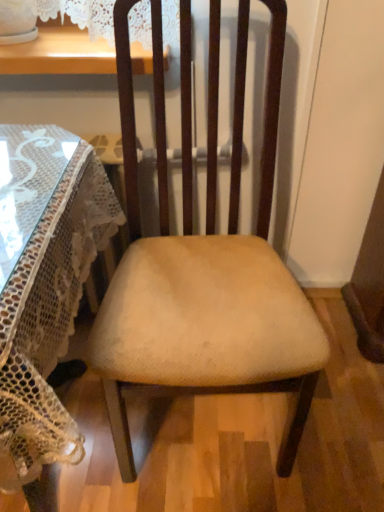
Question: In terms of size, does beige fabric chair at center appear bigger or smaller than transparent glass table at left?

Choices:
 (A) small
 (B) big

Answer: (A)

Question: Would you say beige fabric chair at center is inside or outside transparent glass table at left?

Choices:
 (A) inside
 (B) outside

Answer: (B)

Question: Considering the positions of beige fabric chair at center and transparent glass table at left in the image, is beige fabric chair at center wider or thinner than transparent glass table at left?

Choices:
 (A) thin
 (B) wide

Answer: (A)

Question: Looking at the image, does transparent glass table at left seem bigger or smaller compared to beige fabric chair at center?

Choices:
 (A) big
 (B) small

Answer: (A)

Question: Considering the relative positions of transparent glass table at left and beige fabric chair at center in the image provided, is transparent glass table at left to the left or to the right of beige fabric chair at center?

Choices:
 (A) right
 (B) left

Answer: (B)

Question: From their relative heights in the image, would you say transparent glass table at left is taller or shorter than beige fabric chair at center?

Choices:
 (A) short
 (B) tall

Answer: (A)

Question: Considering the positions of point (3, 318) and point (165, 368), is point (3, 318) closer or farther from the camera than point (165, 368)?

Choices:
 (A) farther
 (B) closer

Answer: (B)